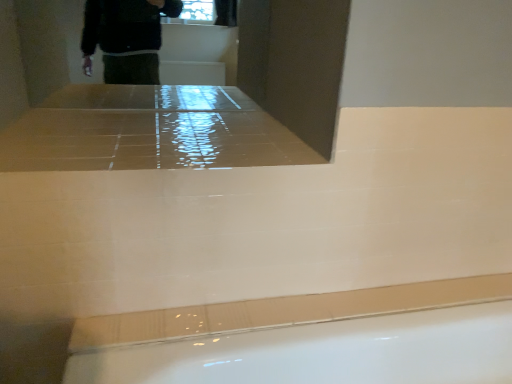
Find the location of a particular element. free spot above white glossy bath at lower center (from a real-world perspective) is located at coordinates (349, 305).